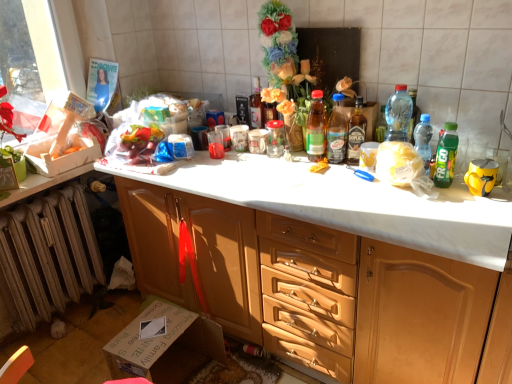
Where is `free spot above wooden cabinet at center (from a real-world perspective)`? The height and width of the screenshot is (384, 512). free spot above wooden cabinet at center (from a real-world perspective) is located at coordinates (304, 173).